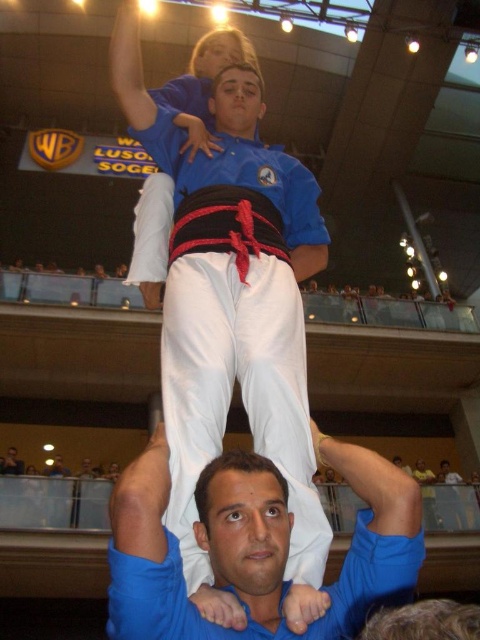
You are a photographer positioned at the base of the pyramid. You want to capture a photo that includes both the white cotton pants at lower center and the white cotton pants at center. Given that your camera has a maximum focus range of 15 feet, will you be able to capture both subjects in focus?

The white cotton pants at lower center is 14.77 feet away from white cotton pants at center. Since the maximum focus range is 15 feet, the distance between them is within the camera range. Therefore, both subjects can be captured in focus.

What is the exact coordinate of the white cotton pants at lower center in the image?

The white cotton pants at lower center are located at coordinate point (254, 545).